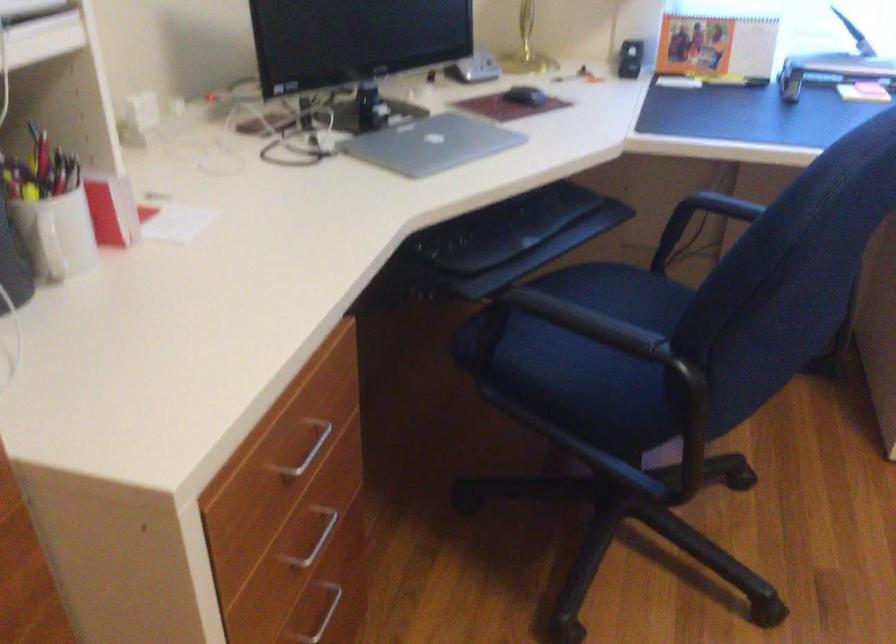
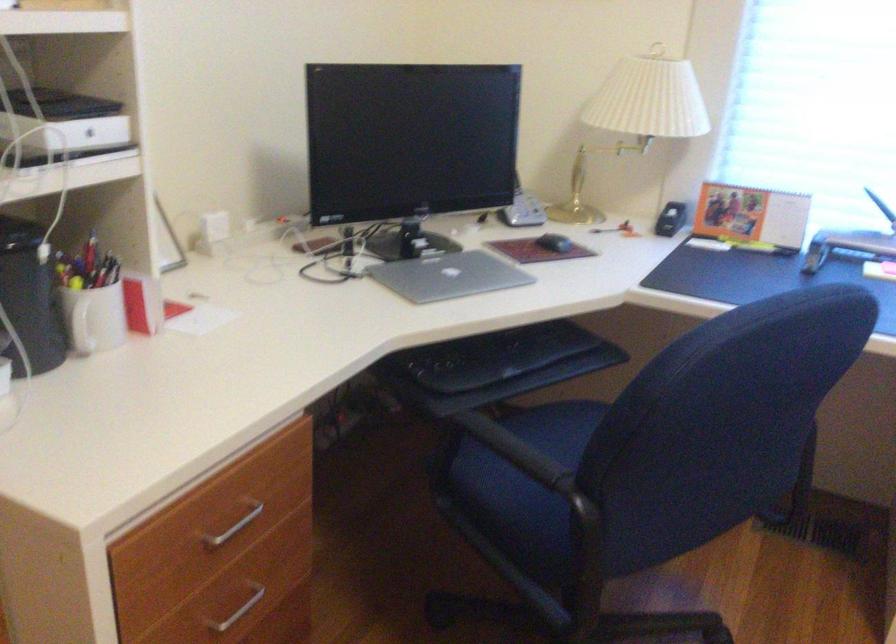
Locate, in the second image, the point that corresponds to point 526,96 in the first image.

(554, 243)